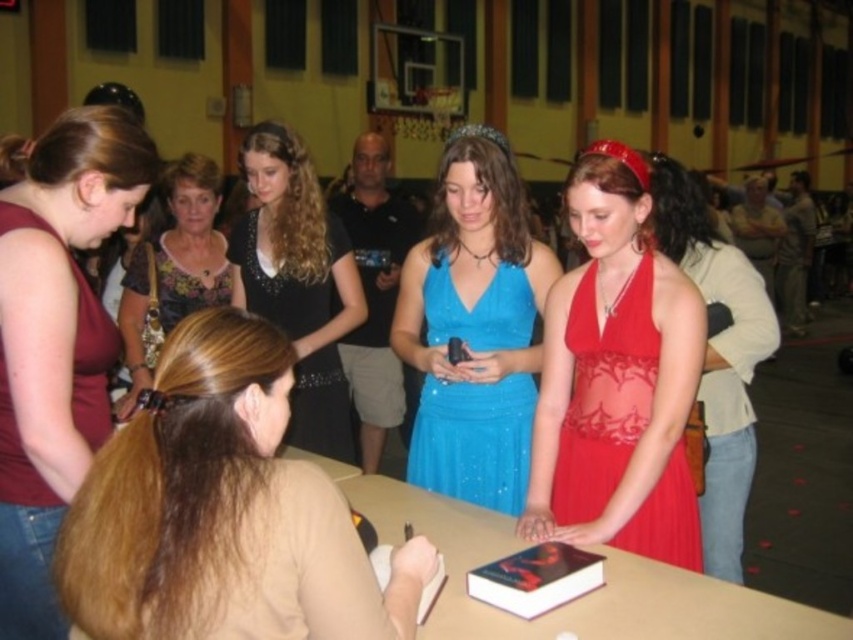
You are a photographer positioned at the back of the gymnasium. You need to capture a photo that includes both the smooth wooden table at center and the sparkly blue dress at center. Based on their positions, which object should you adjust your camera angle to focus on first to ensure both are in frame?

The smooth wooden table at center is positioned on the right side of the sparkly blue dress at center. To include both in the frame, you should first focus on the sparkly blue dress at center since the table is to its right, ensuring the dress is centered before adjusting to include the table on the right.